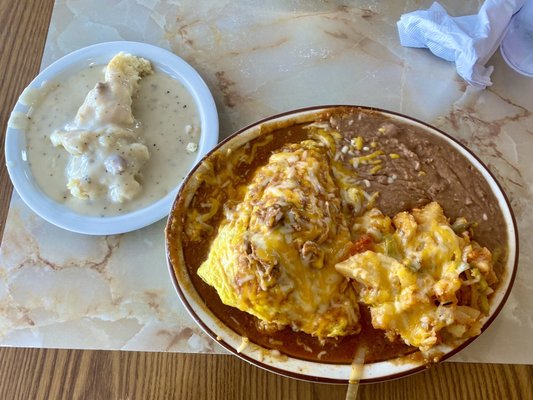
Locate an element on the screen. Image resolution: width=533 pixels, height=400 pixels. napkin is located at coordinates (467, 31).